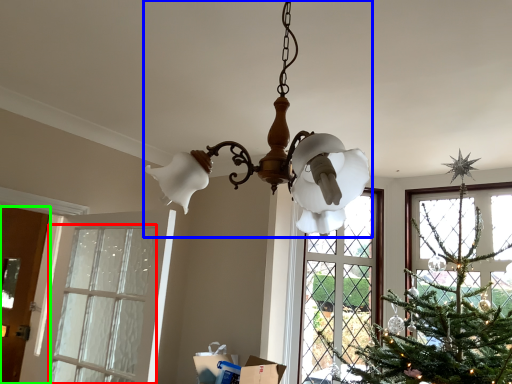
Question: Considering the real-world distances, which object is closest to window (highlighted by a red box)? lamp (highlighted by a blue box) or door (highlighted by a green box).

Choices:
 (A) lamp
 (B) door

Answer: (B)